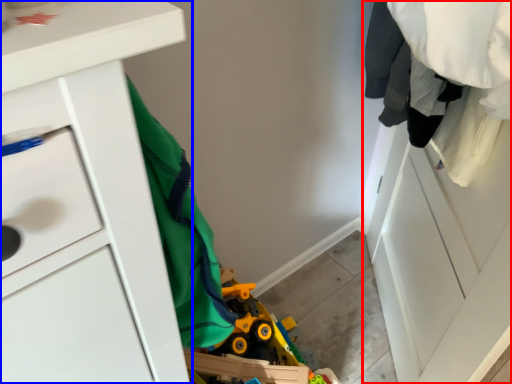
Question: Which object is further to the camera taking this photo, closet (highlighted by a red box) or chest of drawers (highlighted by a blue box)?

Choices:
 (A) closet
 (B) chest of drawers

Answer: (A)